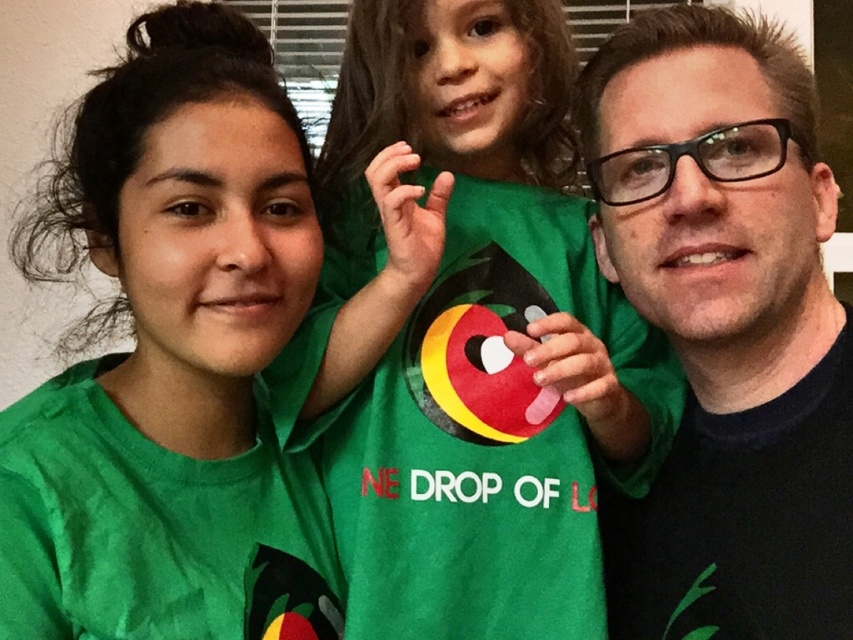
Can you confirm if green matte shirt at upper center is wider than black matte shirt at center?

Correct, the width of green matte shirt at upper center exceeds that of black matte shirt at center.

Based on the photo, can you confirm if green matte shirt at upper center is positioned to the left of black matte shirt at center?

Yes, green matte shirt at upper center is to the left of black matte shirt at center.

Is point (175, 204) farther from viewer compared to point (595, 138)?

No, it is not.

Identify the location of green matte shirt at upper center. The width and height of the screenshot is (853, 640). point(175,362).

Is point (605, 349) in front of point (650, 86)?

That is False.

In the scene shown: Who is more distant from viewer, [415,381] or [833,353]?

Point [415,381]

Where is `green matte shirt at center`? green matte shirt at center is located at coordinates (473, 332).

Which is above, green matte shirt at center or green matte shirt at upper center?

green matte shirt at center is higher up.

Can you confirm if green matte shirt at center is taller than green matte shirt at upper center?

Yes.

Between point (520, 241) and point (311, 612), which one is positioned behind?

Positioned behind is point (520, 241).

Image resolution: width=853 pixels, height=640 pixels. What are the coordinates of `green matte shirt at center` in the screenshot? It's located at (473, 332).